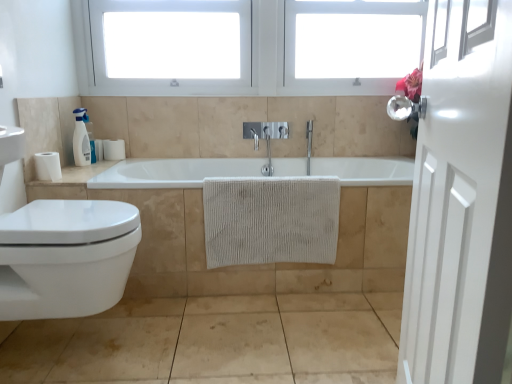
Where is `white matte toilet paper at left, placed as the second toilet paper when sorted from top to bottom`? This screenshot has height=384, width=512. white matte toilet paper at left, placed as the second toilet paper when sorted from top to bottom is located at coordinates (48, 166).

This screenshot has height=384, width=512. I want to click on white glossy door at right, so click(461, 217).

At what (x,y) coordinates should I click in order to perform the action: click on white matte toilet paper at left, the 2th toilet paper viewed from the back. Please return your answer as a coordinate pair (x, y). Looking at the image, I should click on (48, 166).

Between white glossy toilet at lower left and white glossy soap dispenser at upper left, which one is positioned behind?

white glossy soap dispenser at upper left is behind.

From the picture: Are white glossy toilet at lower left and white glossy soap dispenser at upper left making contact?

white glossy toilet at lower left and white glossy soap dispenser at upper left are clearly separated.

Identify the location of soap dispenser behind the white glossy toilet at lower left. (81, 138).

Can you confirm if white glossy toilet at lower left is positioned to the left of white glossy soap dispenser at upper left?

In fact, white glossy toilet at lower left is to the right of white glossy soap dispenser at upper left.

From a real-world perspective, between white glossy toilet at lower left and white glossy door at right, who is vertically lower?

white glossy toilet at lower left is physically lower.

Who is shorter, white glossy toilet at lower left or white glossy door at right?

white glossy toilet at lower left is shorter.

The height and width of the screenshot is (384, 512). I want to click on door located above the white glossy toilet at lower left (from a real-world perspective), so click(461, 217).

From the image's perspective, is white glossy toilet at lower left located above white glossy door at right?

No, from the image's perspective, white glossy toilet at lower left is not above white glossy door at right.

Who is smaller, white glossy countertop at left or beige textured towel at center?

With smaller size is white glossy countertop at left.

Where is `counter top behind the beige textured towel at center`? Image resolution: width=512 pixels, height=384 pixels. counter top behind the beige textured towel at center is located at coordinates (76, 174).

From a real-world perspective, who is located higher, white glossy countertop at left or beige textured towel at center?

From a 3D spatial view, white glossy countertop at left is above.

The image size is (512, 384). Identify the location of bath in front of the white plastic window frame at upper center, the first window frame positioned from the right. (259, 264).

Is white plastic window frame at upper center, the first window frame positioned from the right, smaller than white textured towel at center?

Yes, white plastic window frame at upper center, the first window frame positioned from the right, is smaller than white textured towel at center.

From the picture: Is white plastic window frame at upper center, the first window frame positioned from the right, facing towards white textured towel at center?

No, white plastic window frame at upper center, the first window frame positioned from the right, is not aimed at white textured towel at center.

What's the angular difference between white plastic window frame at upper center, arranged as the second window frame when viewed from the left, and white textured towel at center's facing directions?

0.428 degrees separate the facing orientations of white plastic window frame at upper center, arranged as the second window frame when viewed from the left, and white textured towel at center.

You are a GUI agent. You are given a task and a screenshot of the screen. Output one action in this format:
    pyautogui.click(x=<x>, y=<y>)
    Task: Click on the counter top below the white plastic window at upper center, which is the 1th window frame from left to right (from the image's perspective)
    Image resolution: width=512 pixels, height=384 pixels.
    Given the screenshot: What is the action you would take?
    pyautogui.click(x=76, y=174)

Considering the relative positions of white plastic window at upper center, which is the 1th window frame from left to right, and white glossy countertop at left in the image provided, is white plastic window at upper center, which is the 1th window frame from left to right, behind white glossy countertop at left?

Yes.

Considering the sizes of objects white plastic window at upper center, which is the 1th window frame from left to right, and white glossy countertop at left in the image provided, who is shorter, white plastic window at upper center, which is the 1th window frame from left to right, or white glossy countertop at left?

white glossy countertop at left is shorter.

From the image's perspective, between white matte toilet paper at left, positioned as the second toilet paper in right-to-left order, and white matte toilet paper at left, positioned as the 1th toilet paper in top-to-bottom order, who is located below?

From the image's view, white matte toilet paper at left, positioned as the second toilet paper in right-to-left order, is below.

Which object is positioned more to the right, white matte toilet paper at left, positioned as the second toilet paper in right-to-left order, or white matte toilet paper at left, positioned as the first toilet paper in right-to-left order?

From the viewer's perspective, white matte toilet paper at left, positioned as the first toilet paper in right-to-left order, appears more on the right side.

Considering the sizes of white matte toilet paper at left, placed as the second toilet paper when sorted from top to bottom, and white matte toilet paper at left, positioned as the 1th toilet paper in top-to-bottom order, in the image, is white matte toilet paper at left, placed as the second toilet paper when sorted from top to bottom, bigger or smaller than white matte toilet paper at left, positioned as the 1th toilet paper in top-to-bottom order,?

Clearly, white matte toilet paper at left, placed as the second toilet paper when sorted from top to bottom, is larger in size than white matte toilet paper at left, positioned as the 1th toilet paper in top-to-bottom order.

From a real-world perspective, between white matte toilet paper at left, placed as the first toilet paper when sorted from bottom to top, and white matte toilet paper at left, arranged as the second toilet paper when viewed from the left, who is vertically higher?

white matte toilet paper at left, arranged as the second toilet paper when viewed from the left.

Is white glossy toilet at lower left looking in the opposite direction of white matte toilet paper at left, arranged as the second toilet paper when viewed from the left?

That's not correct — white glossy toilet at lower left is not looking away from white matte toilet paper at left, arranged as the second toilet paper when viewed from the left.

Does point (119, 256) come in front of point (122, 139)?

Yes, it is in front of point (122, 139).

Choose the correct answer: Is white glossy toilet at lower left inside white matte toilet paper at left, which is the 2th toilet paper from front to back, or outside it?

white glossy toilet at lower left is not enclosed by white matte toilet paper at left, which is the 2th toilet paper from front to back.

In the image, is white glossy toilet at lower left on the left side or the right side of white matte toilet paper at left, positioned as the 1th toilet paper in top-to-bottom order?

white glossy toilet at lower left is to the right of white matte toilet paper at left, positioned as the 1th toilet paper in top-to-bottom order.

Locate an element on the screen. This screenshot has width=512, height=384. soap dispenser on the left side of white glossy toilet at lower left is located at coordinates (81, 138).

In the image, there is a white glossy toilet at lower left. Identify the location of door above it (from the image's perspective). (461, 217).

Estimate the real-world distances between objects in this image. Which object is closer to white glossy toilet at lower left, white matte toilet paper at left, positioned as the first toilet paper in right-to-left order, or white textured towel at center?

Based on the image, white textured towel at center appears to be nearer to white glossy toilet at lower left.

Based on their spatial positions, is white plastic window at upper center, which is the 1th window frame from left to right, or white matte toilet paper at left, which is the 2th toilet paper from front to back, further from beige textured towel at center?

The object further to beige textured towel at center is white matte toilet paper at left, which is the 2th toilet paper from front to back.

Considering their positions, is white glossy door at right positioned closer to beige textured towel at center than white plastic window frame at upper center, the first window frame positioned from the right?

white glossy door at right is positioned closer to the anchor beige textured towel at center.

When comparing their distances from white glossy soap dispenser at upper left, does white matte toilet paper at left, positioned as the first toilet paper in right-to-left order, or white glossy door at right seem closer?

white matte toilet paper at left, positioned as the first toilet paper in right-to-left order, is positioned closer to the anchor white glossy soap dispenser at upper left.

When comparing their distances from white glossy soap dispenser at upper left, does white glossy toilet at lower left or white plastic window at upper center, which is the 1th window frame from left to right, seem closer?

Based on the image, white plastic window at upper center, which is the 1th window frame from left to right, appears to be nearer to white glossy soap dispenser at upper left.

From the image, which object appears to be nearer to white glossy toilet at lower left, beige textured towel at center or white plastic window frame at upper center, arranged as the second window frame when viewed from the left?

Among the two, beige textured towel at center is located nearer to white glossy toilet at lower left.

Considering their positions, is white glossy toilet at lower left positioned closer to white matte toilet paper at left, placed as the second toilet paper when sorted from top to bottom, than white textured towel at center?

white glossy toilet at lower left lies closer to white matte toilet paper at left, placed as the second toilet paper when sorted from top to bottom, than the other object.

Which object lies nearer to the anchor point white glossy soap dispenser at upper left, white glossy door at right or white matte toilet paper at left, which is the 2th toilet paper from front to back?

white matte toilet paper at left, which is the 2th toilet paper from front to back, lies closer to white glossy soap dispenser at upper left than the other object.

You are a GUI agent. You are given a task and a screenshot of the screen. Output one action in this format:
    pyautogui.click(x=<x>, y=<y>)
    Task: Click on the bath towel between white glossy countertop at left and white textured towel at center from left to right
    The image size is (512, 384).
    Given the screenshot: What is the action you would take?
    pyautogui.click(x=271, y=220)

At what (x,y) coordinates should I click in order to perform the action: click on window frame between white plastic window frame at upper center, arranged as the second window frame when viewed from the left, and white textured towel at center, in the vertical direction. Please return your answer as a coordinate pair (x, y). This screenshot has height=384, width=512. Looking at the image, I should click on (168, 46).

Find the location of a particular element. This screenshot has height=384, width=512. toilet paper positioned between white glossy door at right and white plastic window frame at upper center, the first window frame positioned from the right, from near to far is located at coordinates (48, 166).

I want to click on toilet between white glossy door at right and white matte toilet paper at left, which is the 2th toilet paper from front to back, from front to back, so click(x=66, y=257).